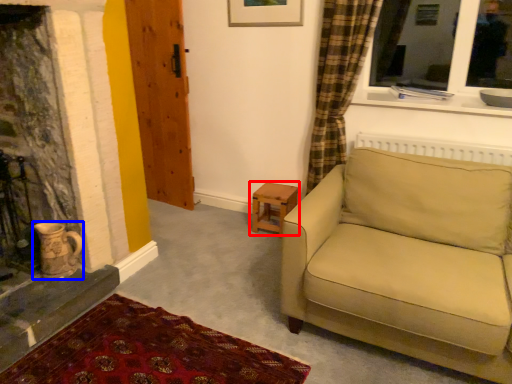
Question: Among these objects, which one is nearest to the camera, table (highlighted by a red box) or tea pot (highlighted by a blue box)?

Choices:
 (A) table
 (B) tea pot

Answer: (B)